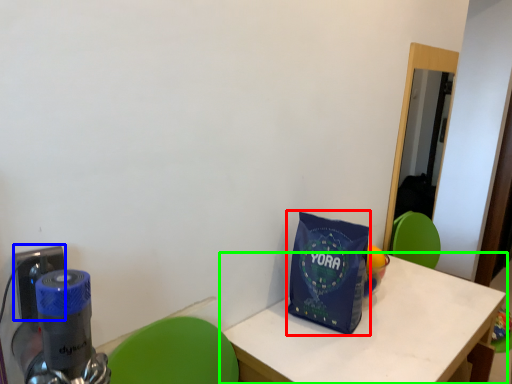
Question: Considering the real-world distances, which object is farthest from tote bag (highlighted by a red box)? electric outlet (highlighted by a blue box) or table (highlighted by a green box)?

Choices:
 (A) electric outlet
 (B) table

Answer: (A)